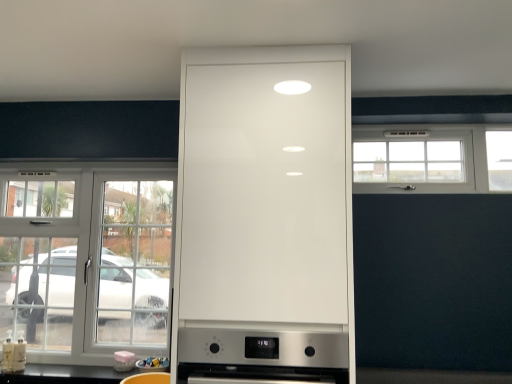
Question: In terms of width, does white glossy cup at lower center, positioned as the first appliance in left-to-right order, look wider or thinner when compared to white glossy cabinet at center?

Choices:
 (A) wide
 (B) thin

Answer: (B)

Question: From the image's perspective, is white glossy cup at lower center, which is counted as the second appliance, starting from the right, above or below white glossy cabinet at center?

Choices:
 (A) above
 (B) below

Answer: (B)

Question: Which object is the closest to the white plastic window at upper right, the 2th window when ordered from bottom to top?

Choices:
 (A) white glass window at left, the first window positioned from the left
 (B) white glossy cabinet at center
 (C) stainless steel oven at center
 (D) white glossy cup at lower center, which is counted as the second appliance, starting from the right
 (E) black glossy countertop at lower left

Answer: (B)

Question: Which is farther from the matte plastic container at lower center, arranged as the second appliance when viewed from the left?

Choices:
 (A) white glossy cabinet at center
 (B) stainless steel oven at center
 (C) white glass window at left, the 1th window ordered from the bottom
 (D) white glossy cup at lower center, positioned as the first appliance in left-to-right order
 (E) white plastic window at upper right, which is the 1th window in top-to-bottom order

Answer: (E)